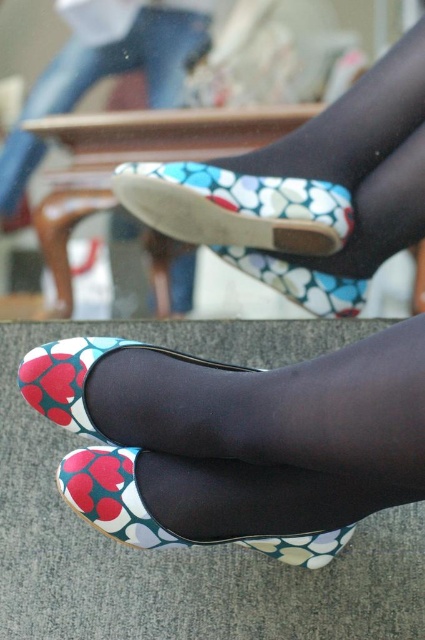
You are standing in a room and see two shoes at the center of the image. Which one is closer to you, the floral fabric shoe at center or the matte floral shoe at center?

The floral fabric shoe at center is closer to you because the matte floral shoe at center is behind it.

You are standing in a room and see the image. There is a point at coordinates (235,208). What object is located at that point?

The point at coordinates (235,208) indicates the floral fabric shoe at center.

You are standing in a room and see the image. The coordinates given are in the format of x and y between 0 and 1. The origin is at the bottom left corner of the image. If you want to reach the matte floral shoe at upper center, which direction should you move from your current position at point 0.5, 0.5?

Since the origin is at the bottom left corner, the coordinates of the matte floral shoe at upper center are at point (127,60). Your current position is at (212,320). To reach the shoe, you should move to the left and upwards.